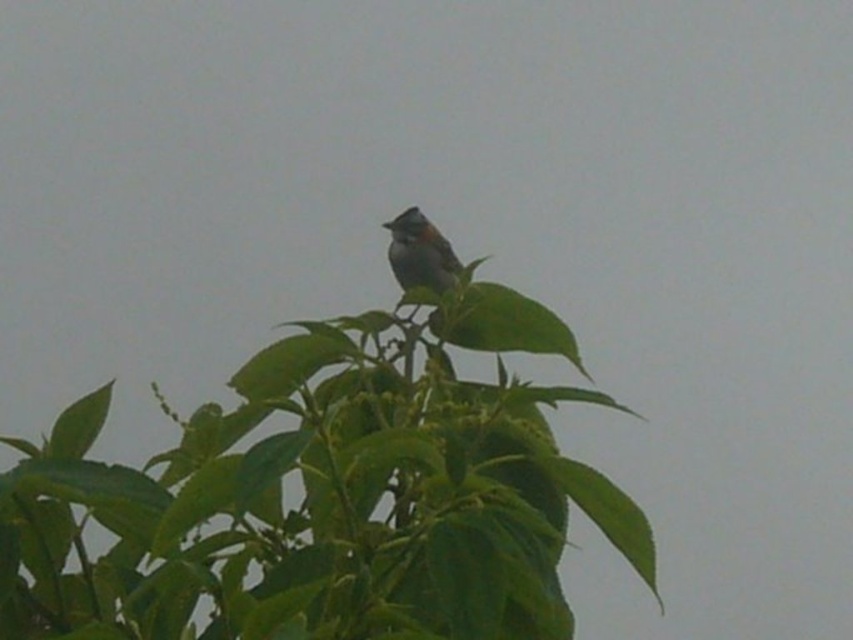
Question: Is green leafy tree at upper center closer to camera compared to brown speckled bird at center?

Choices:
 (A) no
 (B) yes

Answer: (B)

Question: Is green leafy tree at upper center thinner than brown speckled bird at center?

Choices:
 (A) yes
 (B) no

Answer: (B)

Question: Is green leafy tree at upper center positioned at the back of brown speckled bird at center?

Choices:
 (A) no
 (B) yes

Answer: (A)

Question: Among these points, which one is farthest from the camera?

Choices:
 (A) (415, 232)
 (B) (265, 365)

Answer: (A)

Question: Which of the following is the closest to the observer?

Choices:
 (A) brown speckled bird at center
 (B) green leafy tree at upper center

Answer: (B)